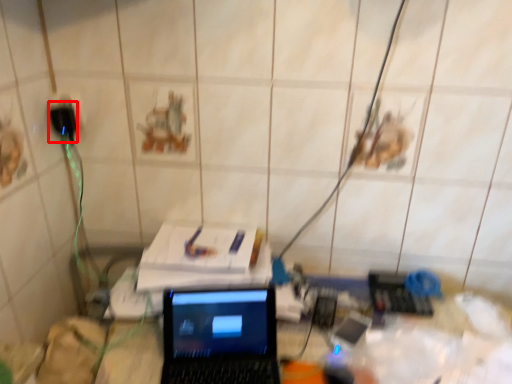
Question: Considering the relative positions of plug (annotated by the red box) and laptop in the image provided, where is plug (annotated by the red box) located with respect to the staircase?

Choices:
 (A) right
 (B) left

Answer: (B)